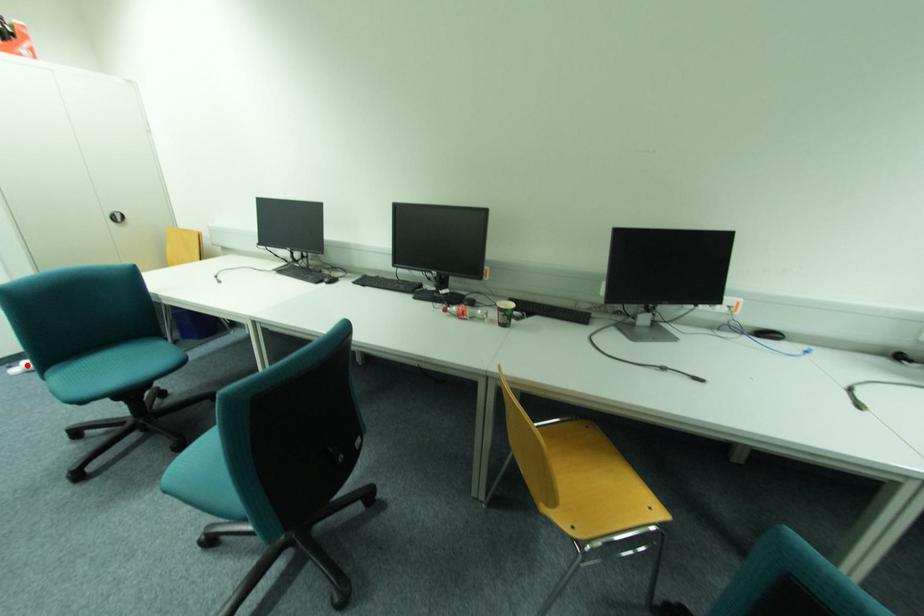
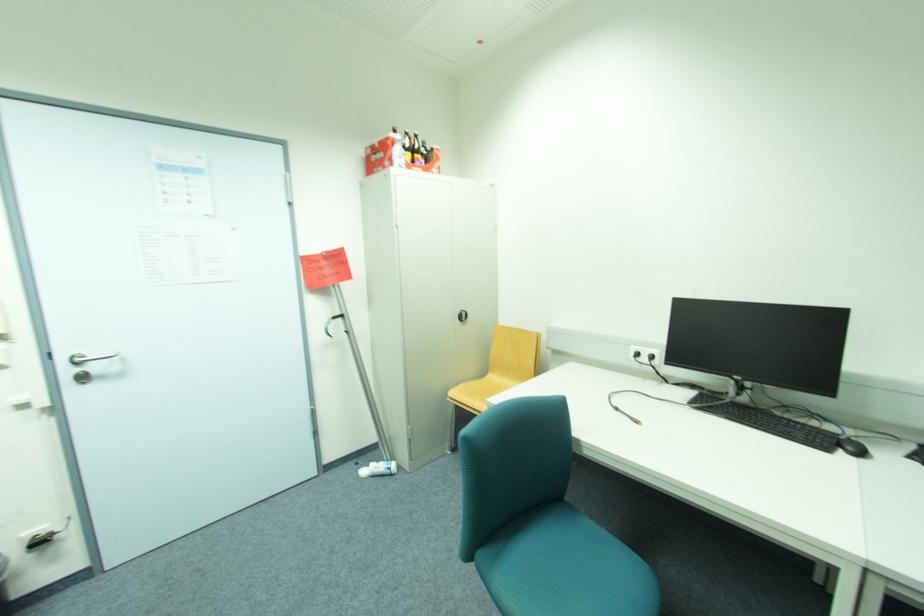
Question: I am providing you with two images of the same scene from different viewpoints. In image1, a red point is highlighted. Considering the same 3D point in image2, which of the following is correct?

Choices:
 (A) It is closer
 (B) It is farther

Answer: (B)